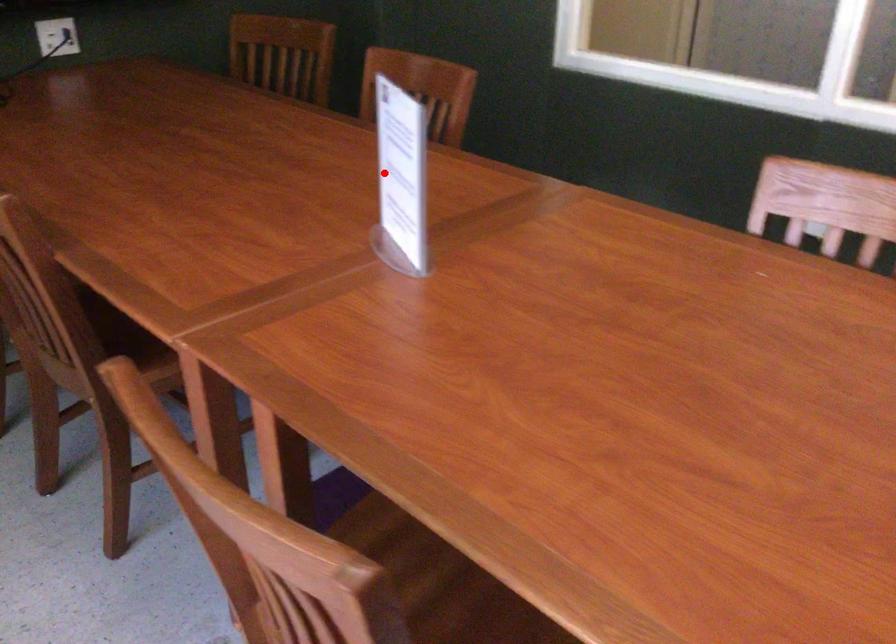
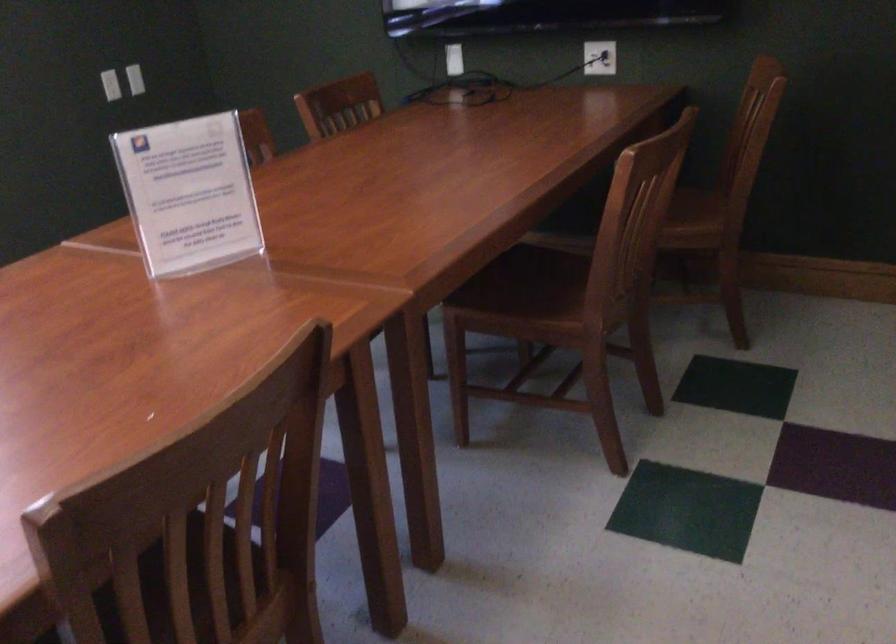
Find the pixel in the second image that matches the highlighted location in the first image.

(188, 194)